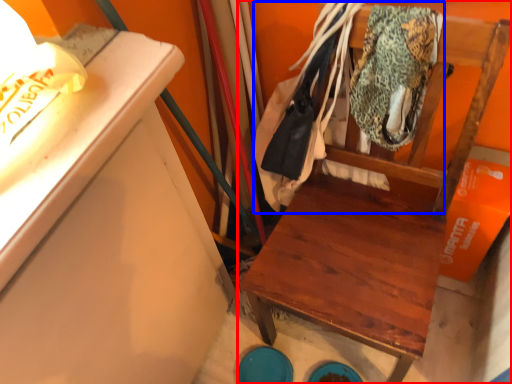
Question: Which point is closer to the camera, furniture (highlighted by a red box) or laundry (highlighted by a blue box)?

Choices:
 (A) furniture
 (B) laundry

Answer: (A)